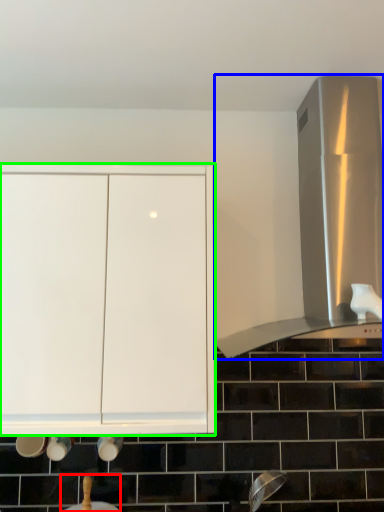
Question: Which object is the closest to the sink (highlighted by a red box)? Choose among these: vent (highlighted by a blue box) or cabinetry (highlighted by a green box).

Choices:
 (A) vent
 (B) cabinetry

Answer: (B)